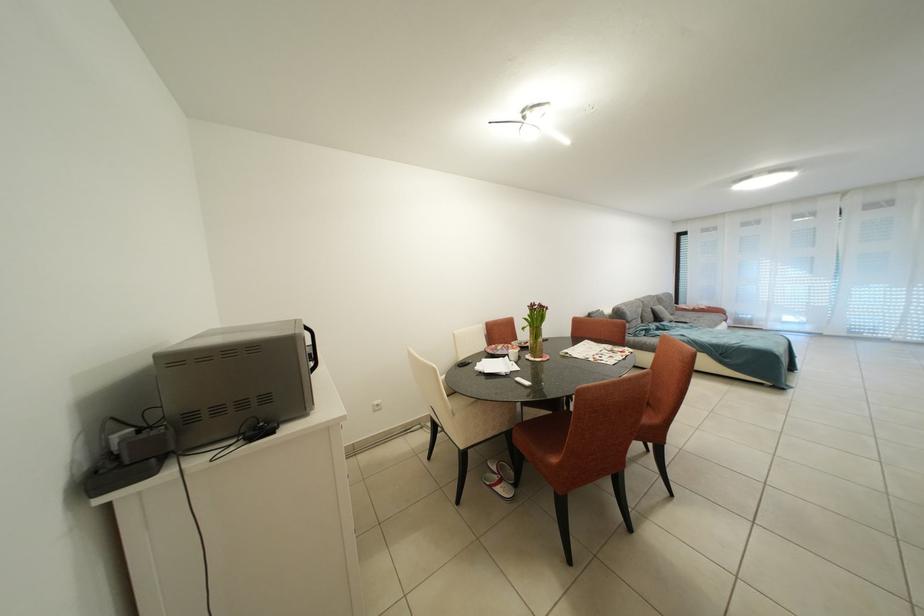
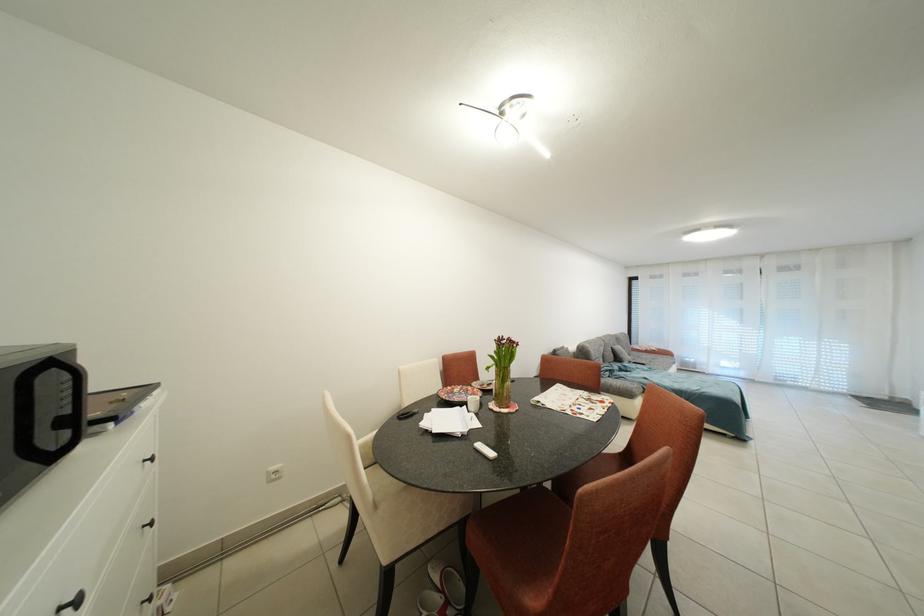
Question: The images are taken continuously from a first-person perspective. In which direction is your viewpoint rotating?

Choices:
 (A) Left
 (B) Right
 (C) Up
 (D) Down

Answer: (B)